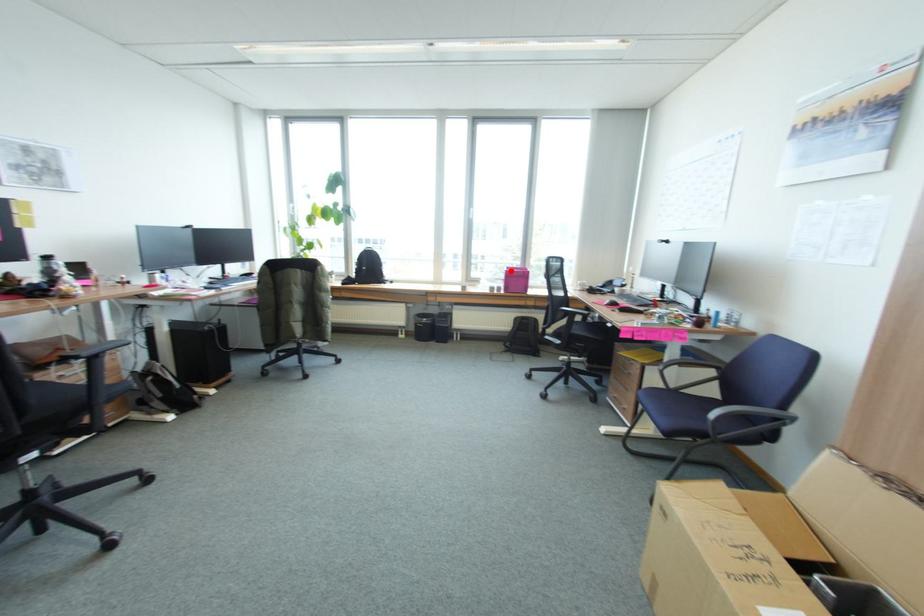
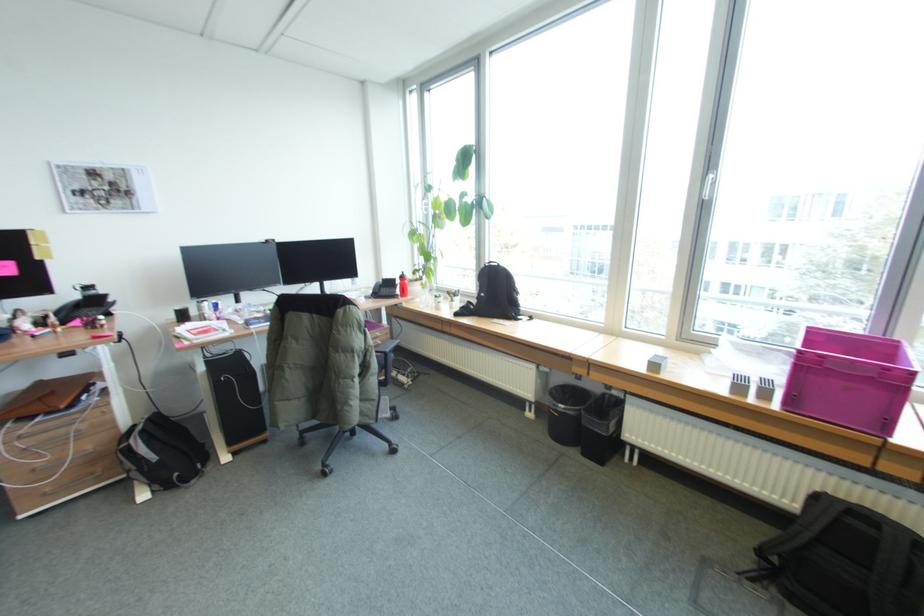
Where in the second image is the point corresponding to the highlighted location from the first image?

(803, 350)